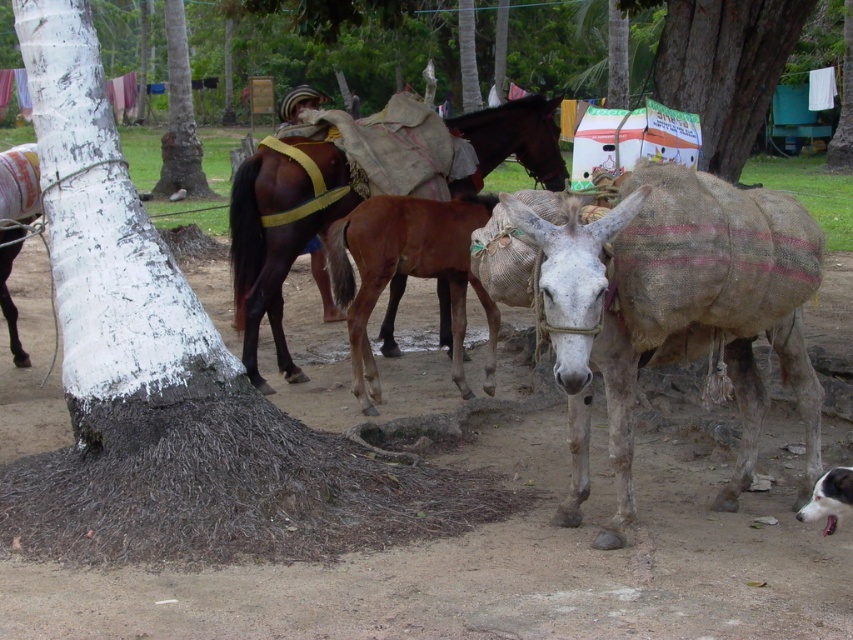
What do you see at coordinates (277, 237) in the screenshot? I see `brown matte horse at center` at bounding box center [277, 237].

Which is behind, point (239, 192) or point (659, 40)?

The point (659, 40) is behind.

I want to click on brown matte horse at center, so click(x=277, y=237).

Who is taller, white painted bark at center left or smooth bark tree at upper center?

With more height is white painted bark at center left.

What do you see at coordinates (109, 253) in the screenshot? I see `white painted bark at center left` at bounding box center [109, 253].

Between point (120, 285) and point (706, 148), which one is positioned behind?

Positioned behind is point (706, 148).

Image resolution: width=853 pixels, height=640 pixels. Identify the location of white painted bark at center left. (109, 253).

Is grayish-white burlap sack at center above smooth bark tree at upper center?

Incorrect, grayish-white burlap sack at center is not positioned above smooth bark tree at upper center.

Can you confirm if grayish-white burlap sack at center is positioned below smooth bark tree at upper center?

Correct, grayish-white burlap sack at center is located below smooth bark tree at upper center.

The width and height of the screenshot is (853, 640). What do you see at coordinates (675, 310) in the screenshot?
I see `grayish-white burlap sack at center` at bounding box center [675, 310].

What are the coordinates of `grayish-white burlap sack at center` in the screenshot? It's located at (675, 310).